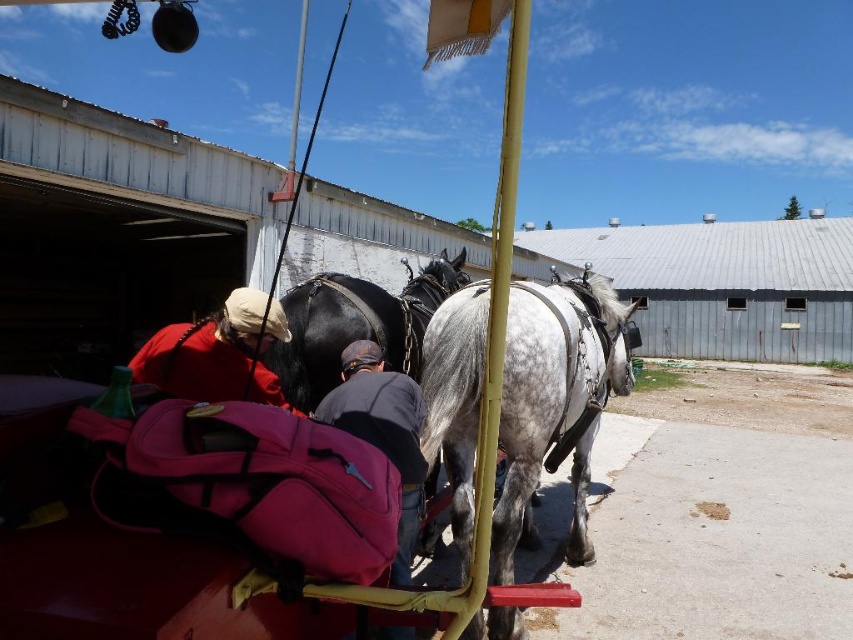
Consider the image. Who is positioned more to the left, black glossy horse at center or dark gray fabric at center?

black glossy horse at center

Does point (416, 280) lie in front of point (354, 397)?

No, (416, 280) is further to viewer.

What do you see at coordinates (357, 324) in the screenshot? The image size is (853, 640). I see `black glossy horse at center` at bounding box center [357, 324].

The width and height of the screenshot is (853, 640). I want to click on black glossy horse at center, so click(357, 324).

Between point (335, 284) and point (163, 346), which one is positioned in front?

Point (163, 346) is more forward.

What do you see at coordinates (357, 324) in the screenshot? I see `black glossy horse at center` at bounding box center [357, 324].

You are a GUI agent. You are given a task and a screenshot of the screen. Output one action in this format:
    pyautogui.click(x=<x>, y=<y>)
    Task: Click on the black glossy horse at center
    The image size is (853, 640).
    Given the screenshot: What is the action you would take?
    pyautogui.click(x=357, y=324)

How much distance is there between speckled white horse at center and matte red jacket at upper left?

1.52 meters

Is speckled white horse at center above matte red jacket at upper left?

Actually, speckled white horse at center is below matte red jacket at upper left.

Is point (477, 340) behind point (247, 317)?

Yes, it is.

Where is `speckled white horse at center`? This screenshot has height=640, width=853. speckled white horse at center is located at coordinates (556, 397).